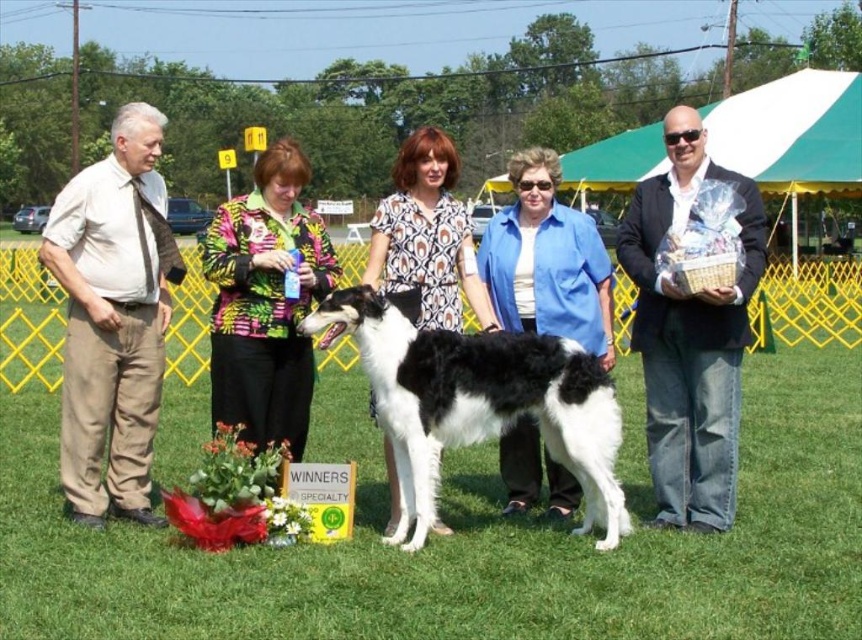
From the picture: Does beige cotton pants at left have a greater width compared to black and white fur at center?

Correct, the width of beige cotton pants at left exceeds that of black and white fur at center.

Who is higher up, beige cotton pants at left or black and white fur at center?

beige cotton pants at left

You are a GUI agent. You are given a task and a screenshot of the screen. Output one action in this format:
    pyautogui.click(x=<x>, y=<y>)
    Task: Click on the beige cotton pants at left
    This screenshot has height=640, width=862.
    Given the screenshot: What is the action you would take?
    pyautogui.click(x=113, y=317)

This screenshot has height=640, width=862. Find the location of `beige cotton pants at left`. beige cotton pants at left is located at coordinates (113, 317).

Locate an element on the screen. beige cotton pants at left is located at coordinates (113, 317).

Does beige cotton pants at left have a smaller size compared to denim jacket at right?

Incorrect, beige cotton pants at left is not smaller in size than denim jacket at right.

Locate an element on the screen. The height and width of the screenshot is (640, 862). beige cotton pants at left is located at coordinates (113, 317).

Is point (451, 438) positioned behind point (689, 433)?

No, (451, 438) is closer to viewer.

Is point (470, 342) positioned before point (672, 120)?

Yes.

Identify the location of black and white fur at center. This screenshot has height=640, width=862. (478, 401).